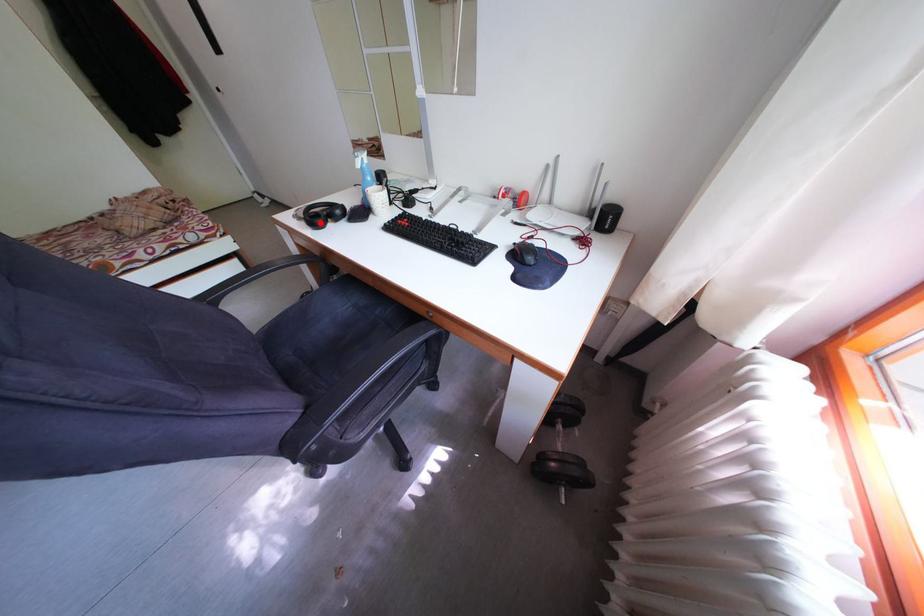
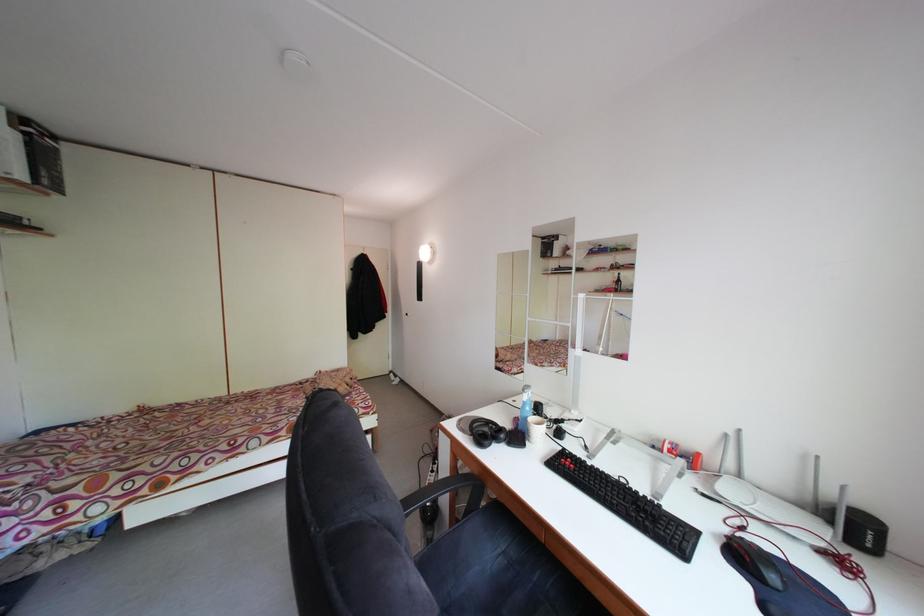
Question: I am providing you with two images of the same scene from different viewpoints. Image1 has a red point marked. In image2, the corresponding 3D location appears at what relative position? Reply with the corresponding letter.

Choices:
 (A) Closer
 (B) Farther

Answer: (B)